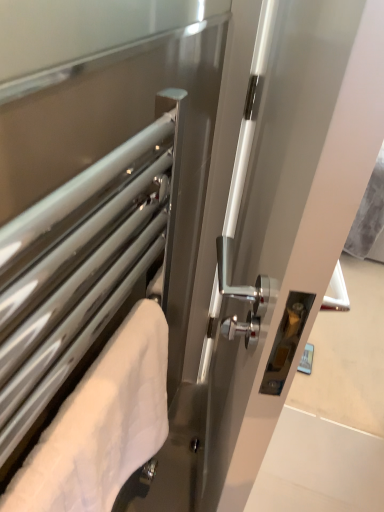
Describe the element at coordinates (101, 198) in the screenshot. The image size is (384, 512). I see `satin silver towel rack at left, the 1th screen door in the left-to-right sequence` at that location.

I want to click on white glossy handle at center, the 2th screen door positioned from the left, so click(x=286, y=220).

This screenshot has height=512, width=384. Describe the element at coordinates (101, 424) in the screenshot. I see `white fluffy towel at left` at that location.

Identify the location of satin silver towel rack at left, positioned as the second screen door in right-to-left order. (101, 198).

Is white glossy handle at center, which is the 1th screen door in right-to-left order, thinner than satin silver towel rack at left, the 1th screen door in the left-to-right sequence?

In fact, white glossy handle at center, which is the 1th screen door in right-to-left order, might be wider than satin silver towel rack at left, the 1th screen door in the left-to-right sequence.

At what (x,y) coordinates should I click in order to perform the action: click on screen door lying behind the satin silver towel rack at left, the 1th screen door in the left-to-right sequence. Please return your answer as a coordinate pair (x, y). This screenshot has height=512, width=384. Looking at the image, I should click on (286, 220).

Between white glossy handle at center, the 2th screen door positioned from the left, and satin silver towel rack at left, the 1th screen door in the left-to-right sequence, which one is positioned in front?

satin silver towel rack at left, the 1th screen door in the left-to-right sequence, is closer to the camera.

From the image's perspective, does white glossy handle at center, which is the 1th screen door in right-to-left order, appear higher than satin silver towel rack at left, positioned as the second screen door in right-to-left order?

Yes, from the image's perspective, white glossy handle at center, which is the 1th screen door in right-to-left order, is over satin silver towel rack at left, positioned as the second screen door in right-to-left order.

Can you confirm if white fluffy towel at left is taller than white glossy handle at center, which is the 1th screen door in right-to-left order?

No.

Is point (74, 405) farther from camera compared to point (252, 127)?

No, (74, 405) is closer to viewer.

Is white fluffy towel at left to the left of white glossy handle at center, the 2th screen door positioned from the left, from the viewer's perspective?

Yes, white fluffy towel at left is to the left of white glossy handle at center, the 2th screen door positioned from the left.

How different are the orientations of white fluffy towel at left and white glossy handle at center, the 2th screen door positioned from the left, in degrees?

The angular difference between white fluffy towel at left and white glossy handle at center, the 2th screen door positioned from the left, is 13.1 degrees.

Is white glossy handle at center, the 2th screen door positioned from the left, surrounded by satin silver towel rack at left, the 1th screen door in the left-to-right sequence?

No, white glossy handle at center, the 2th screen door positioned from the left, is located outside of satin silver towel rack at left, the 1th screen door in the left-to-right sequence.

Is satin silver towel rack at left, positioned as the second screen door in right-to-left order, far away from white glossy handle at center, which is the 1th screen door in right-to-left order?

No, satin silver towel rack at left, positioned as the second screen door in right-to-left order, is in close proximity to white glossy handle at center, which is the 1th screen door in right-to-left order.

Could you tell me if satin silver towel rack at left, the 1th screen door in the left-to-right sequence, is turned towards white glossy handle at center, which is the 1th screen door in right-to-left order?

No, satin silver towel rack at left, the 1th screen door in the left-to-right sequence, is not turned towards white glossy handle at center, which is the 1th screen door in right-to-left order.

Could white fluffy towel at left be considered to be inside satin silver towel rack at left, positioned as the second screen door in right-to-left order?

Yes, white fluffy towel at left can be found within satin silver towel rack at left, positioned as the second screen door in right-to-left order.

Does satin silver towel rack at left, the 1th screen door in the left-to-right sequence, come behind white fluffy towel at left?

No, satin silver towel rack at left, the 1th screen door in the left-to-right sequence, is closer to the viewer.

What's the angular difference between satin silver towel rack at left, positioned as the second screen door in right-to-left order, and white fluffy towel at left's facing directions?

There is a 0.00578-degree angle between the facing directions of satin silver towel rack at left, positioned as the second screen door in right-to-left order, and white fluffy towel at left.

Between satin silver towel rack at left, the 1th screen door in the left-to-right sequence, and white fluffy towel at left, which one appears on the left side from the viewer's perspective?

From the viewer's perspective, satin silver towel rack at left, the 1th screen door in the left-to-right sequence, appears more on the left side.

Consider the image. Is satin silver towel rack at left, the 1th screen door in the left-to-right sequence, located within white fluffy towel at left?

That's incorrect, satin silver towel rack at left, the 1th screen door in the left-to-right sequence, is not inside white fluffy towel at left.

This screenshot has width=384, height=512. Find the location of `screen door located above the white fluffy towel at left (from a real-world perspective)`. screen door located above the white fluffy towel at left (from a real-world perspective) is located at coordinates (101, 198).

Would you consider white fluffy towel at left to be distant from satin silver towel rack at left, positioned as the second screen door in right-to-left order?

white fluffy towel at left is actually quite close to satin silver towel rack at left, positioned as the second screen door in right-to-left order.

Considering the positions of points (150, 418) and (167, 274), is point (150, 418) closer to camera compared to point (167, 274)?

Yes, point (150, 418) is closer to viewer.

Identify the location of towel behind the white glossy handle at center, the 2th screen door positioned from the left. (101, 424).

Which is in front, point (286, 99) or point (16, 480)?

The point (16, 480) is closer to the camera.

Can you confirm if white glossy handle at center, which is the 1th screen door in right-to-left order, is taller than white fluffy towel at left?

Correct, white glossy handle at center, which is the 1th screen door in right-to-left order, is much taller as white fluffy towel at left.

Is white glossy handle at center, which is the 1th screen door in right-to-left order, in contact with white fluffy towel at left?

No, white glossy handle at center, which is the 1th screen door in right-to-left order, is not touching white fluffy towel at left.

At what (x,y) coordinates should I click in order to perform the action: click on screen door behind the satin silver towel rack at left, positioned as the second screen door in right-to-left order. Please return your answer as a coordinate pair (x, y). Looking at the image, I should click on (286, 220).

The height and width of the screenshot is (512, 384). I want to click on screen door that appears below the white fluffy towel at left (from a real-world perspective), so click(286, 220).

Which object lies nearer to the anchor point white fluffy towel at left, white glossy handle at center, the 2th screen door positioned from the left, or satin silver towel rack at left, positioned as the second screen door in right-to-left order?

Among the two, satin silver towel rack at left, positioned as the second screen door in right-to-left order, is located nearer to white fluffy towel at left.

Looking at the image, which one is located further to white glossy handle at center, which is the 1th screen door in right-to-left order, satin silver towel rack at left, positioned as the second screen door in right-to-left order, or white fluffy towel at left?

white fluffy towel at left is positioned further to the anchor white glossy handle at center, which is the 1th screen door in right-to-left order.

Which object lies further to the anchor point white glossy handle at center, the 2th screen door positioned from the left, white fluffy towel at left or satin silver towel rack at left, positioned as the second screen door in right-to-left order?

Based on the image, white fluffy towel at left appears to be further to white glossy handle at center, the 2th screen door positioned from the left.

Looking at the image, which one is located further to white fluffy towel at left, satin silver towel rack at left, positioned as the second screen door in right-to-left order, or white glossy handle at center, which is the 1th screen door in right-to-left order?

white glossy handle at center, which is the 1th screen door in right-to-left order.

When comparing their distances from satin silver towel rack at left, positioned as the second screen door in right-to-left order, does white glossy handle at center, which is the 1th screen door in right-to-left order, or white fluffy towel at left seem closer?

Based on the image, white fluffy towel at left appears to be nearer to satin silver towel rack at left, positioned as the second screen door in right-to-left order.

Estimate the real-world distances between objects in this image. Which object is closer to satin silver towel rack at left, positioned as the second screen door in right-to-left order, white fluffy towel at left or white glossy handle at center, which is the 1th screen door in right-to-left order?

white fluffy towel at left.

You are a GUI agent. You are given a task and a screenshot of the screen. Output one action in this format:
    pyautogui.click(x=<x>, y=<y>)
    Task: Click on the towel located between satin silver towel rack at left, positioned as the second screen door in right-to-left order, and white glossy handle at center, the 2th screen door positioned from the left, in the left-right direction
    This screenshot has height=512, width=384.
    Given the screenshot: What is the action you would take?
    [x=101, y=424]